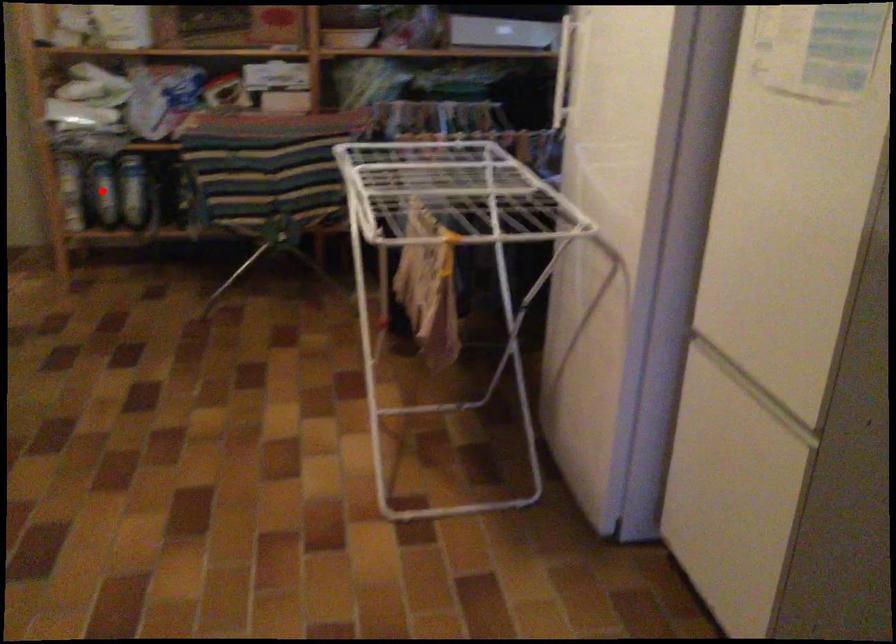
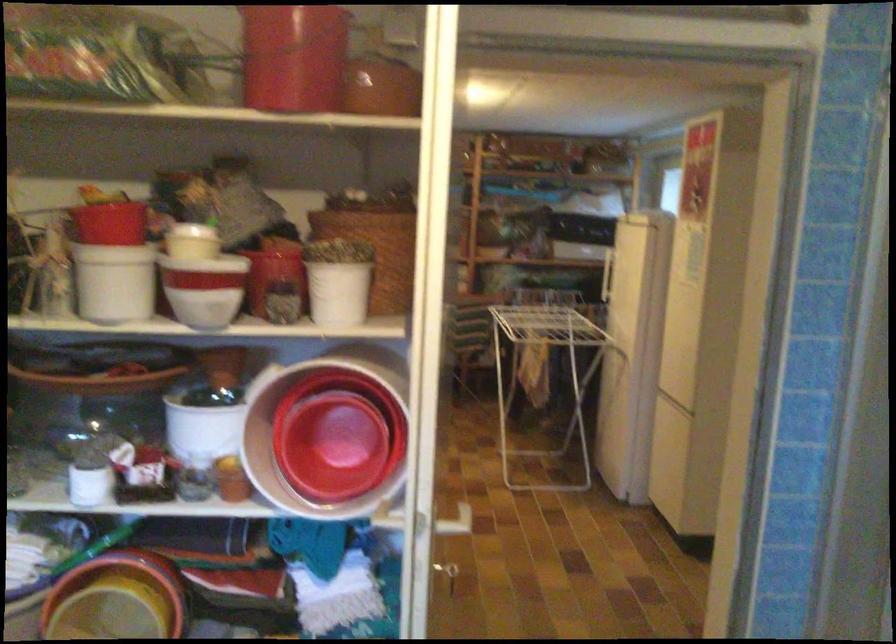
Question: I am providing you with two images of the same scene from different viewpoints. A red point is marked on the first image. At the location where the point appears in image 1, is it still visible in image 2?

Choices:
 (A) Yes
 (B) No

Answer: (B)